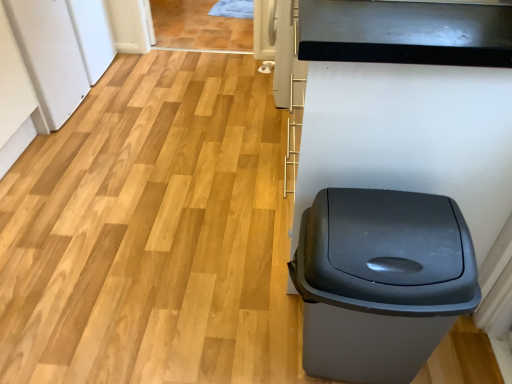
At what (x,y) coordinates should I click in order to perform the action: click on free space that is to the left of matte gray plastic trash can at right. Please return your answer as a coordinate pair (x, y). The height and width of the screenshot is (384, 512). Looking at the image, I should click on (245, 331).